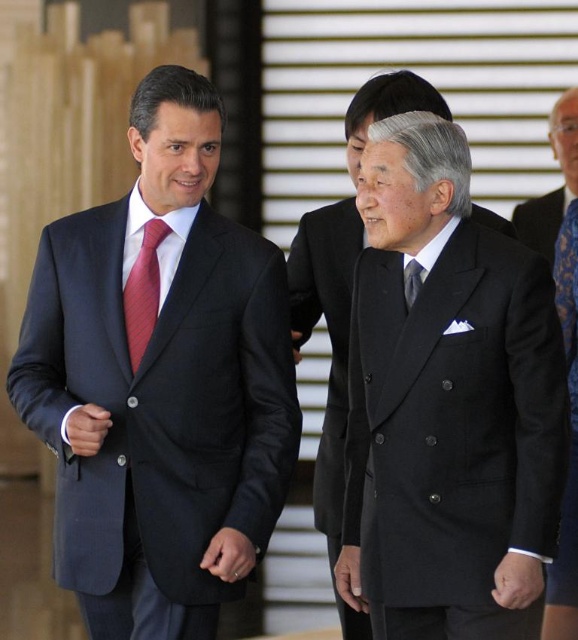
You are a photographer setting up for a formal event. You need to position a spotlight to the right of the blue lace dress at right and another to the left of the black wool suit at center. Will the spotlights overlap each other?

The black wool suit at center is to the left of the blue lace dress at right. Placing a spotlight to the right of the blue lace dress at right and another to the left of the black wool suit at center means the spotlights will be positioned on opposite sides of the two objects, so they will not overlap.

You are a photographer setting up a shoot in this scene. You need to position a spotlight to the right of both the matte black suit at left and the black wool suit at center. Is this possible given their positions?

The matte black suit at left is to the left of the black wool suit at center, so positioning a spotlight to the right of both would be possible as they are arranged from left to right with space on their right side.

From the picture: You are attending a formal event and need to locate two specific attendees. The black woolen suit at center and the blue lace dress at right are in the scene. Which one is positioned to the left?

The black woolen suit at center is positioned to the left of the blue lace dress at right according to the description.